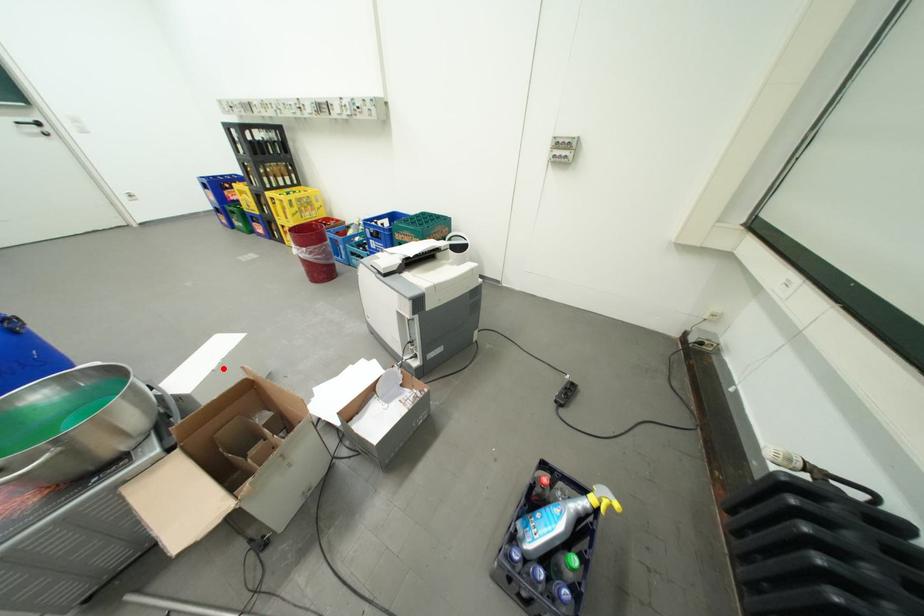
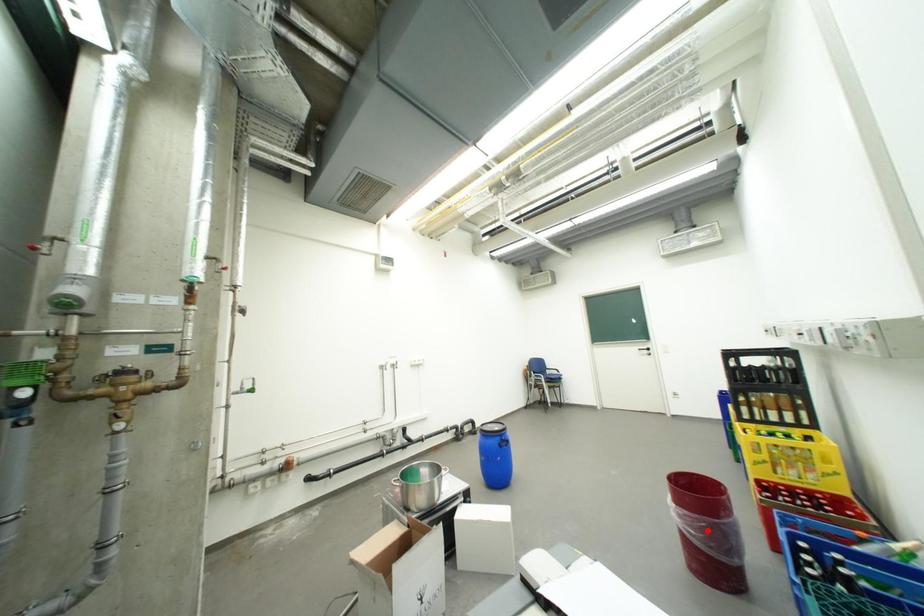
I am providing you with two images of the same scene from different viewpoints. A red point is marked on the first image and another point is marked on the second image. Is the marked point in image1 the same physical position as the marked point in image2?

No